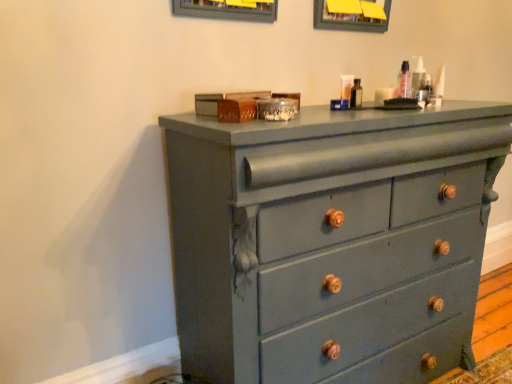
Question: Considering the positions of point (323, 3) and point (418, 89), is point (323, 3) closer or farther from the camera than point (418, 89)?

Choices:
 (A) closer
 (B) farther

Answer: (B)

Question: In the image, is matte gray picture frame at upper center positioned in front of or behind matte plastic container at upper right?

Choices:
 (A) behind
 (B) front

Answer: (A)

Question: Considering the real-world distances, which object is farthest from the matte gray dresser at center?

Choices:
 (A) matte plastic container at upper right
 (B) matte gray picture frame at upper center

Answer: (B)

Question: Considering the real-world distances, which object is farthest from the matte gray picture frame at upper center?

Choices:
 (A) matte gray dresser at center
 (B) matte plastic container at upper right

Answer: (A)